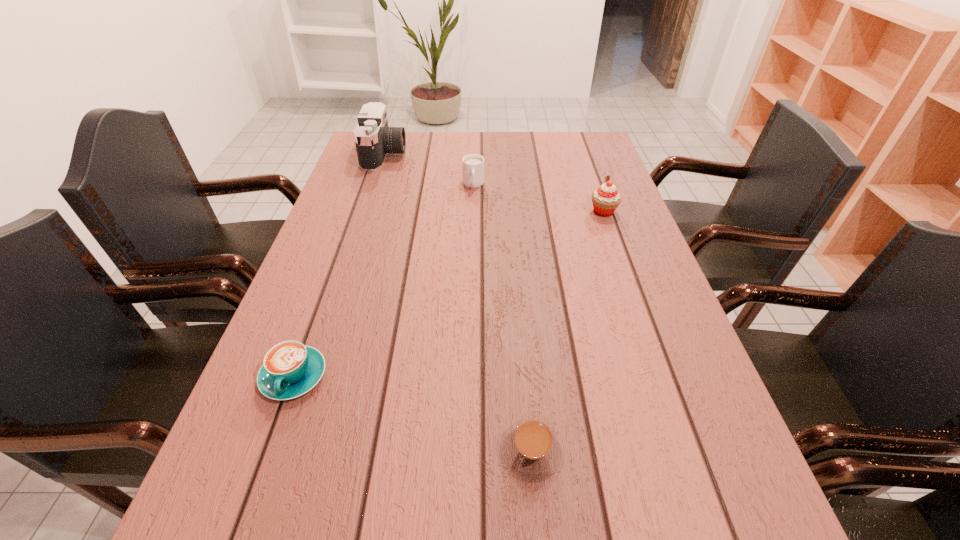
Where is `vacant area that satisfies the following two spatial constraints: 1. on the front-facing side of the tallest object; 2. on the left side of the rightmost object`? vacant area that satisfies the following two spatial constraints: 1. on the front-facing side of the tallest object; 2. on the left side of the rightmost object is located at coordinates (367, 212).

Find the location of a particular element. Image resolution: width=960 pixels, height=540 pixels. vacant space that satisfies the following two spatial constraints: 1. on the front-facing side of the nearest object; 2. on the left side of the tallest object is located at coordinates (288, 451).